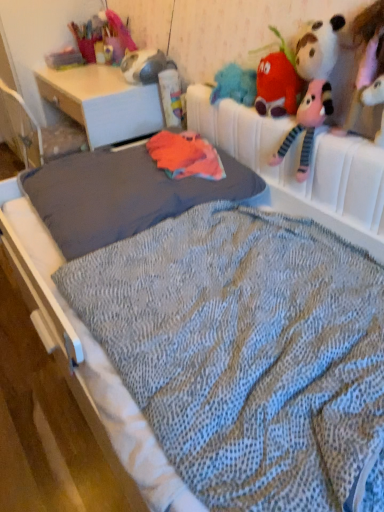
Question: Does knitted plush strawberry at upper right, marked as the second toy in a right-to-left arrangement, lie behind white plush toy at upper right, positioned as the 1th toy in right-to-left order?

Choices:
 (A) yes
 (B) no

Answer: (A)

Question: Is knitted plush strawberry at upper right, which appears as the 2th toy when viewed from the front, positioned in front of white plush toy at upper right, acting as the 2th toy starting from the left?

Choices:
 (A) yes
 (B) no

Answer: (B)

Question: From a real-world perspective, is knitted plush strawberry at upper right, the first toy when ordered from left to right, over white plush toy at upper right, which is the 2th toy in back-to-front order?

Choices:
 (A) yes
 (B) no

Answer: (A)

Question: Can we say knitted plush strawberry at upper right, which appears as the 2th toy when viewed from the front, lies outside white plush toy at upper right, the 1th toy viewed from the front?

Choices:
 (A) yes
 (B) no

Answer: (A)

Question: Can you confirm if knitted plush strawberry at upper right, which ranks as the 1th toy in back-to-front order, is wider than white plush toy at upper right, the 1th toy viewed from the front?

Choices:
 (A) no
 (B) yes

Answer: (B)

Question: From a real-world perspective, is matte white desk at center physically located above or below white plush toy at upper right, acting as the 2th toy starting from the left?

Choices:
 (A) below
 (B) above

Answer: (A)

Question: From the image's perspective, relative to white plush toy at upper right, acting as the 2th toy starting from the left, is matte white desk at center above or below?

Choices:
 (A) above
 (B) below

Answer: (A)

Question: Does point (125, 86) appear closer or farther from the camera than point (362, 94)?

Choices:
 (A) farther
 (B) closer

Answer: (A)

Question: Based on their positions, is matte white desk at center located to the left or right of white plush toy at upper right, acting as the 2th toy starting from the left?

Choices:
 (A) left
 (B) right

Answer: (A)

Question: Is point (261, 88) positioned closer to the camera than point (142, 87)?

Choices:
 (A) closer
 (B) farther

Answer: (A)

Question: In the image, is knitted plush strawberry at upper right, marked as the second toy in a right-to-left arrangement, on the left side or the right side of matte white desk at center?

Choices:
 (A) left
 (B) right

Answer: (B)

Question: Is knitted plush strawberry at upper right, which appears as the 2th toy when viewed from the front, inside the boundaries of matte white desk at center, or outside?

Choices:
 (A) outside
 (B) inside

Answer: (A)

Question: From their relative heights in the image, would you say knitted plush strawberry at upper right, marked as the second toy in a right-to-left arrangement, is taller or shorter than matte white desk at center?

Choices:
 (A) short
 (B) tall

Answer: (A)

Question: From a real-world perspective, relative to white plush toy at upper right, acting as the 2th toy starting from the left, is knitted plush strawberry at upper right, marked as the second toy in a right-to-left arrangement, vertically above or below?

Choices:
 (A) above
 (B) below

Answer: (A)

Question: Is knitted plush strawberry at upper right, which appears as the 2th toy when viewed from the front, taller or shorter than white plush toy at upper right, the 1th toy viewed from the front?

Choices:
 (A) short
 (B) tall

Answer: (B)